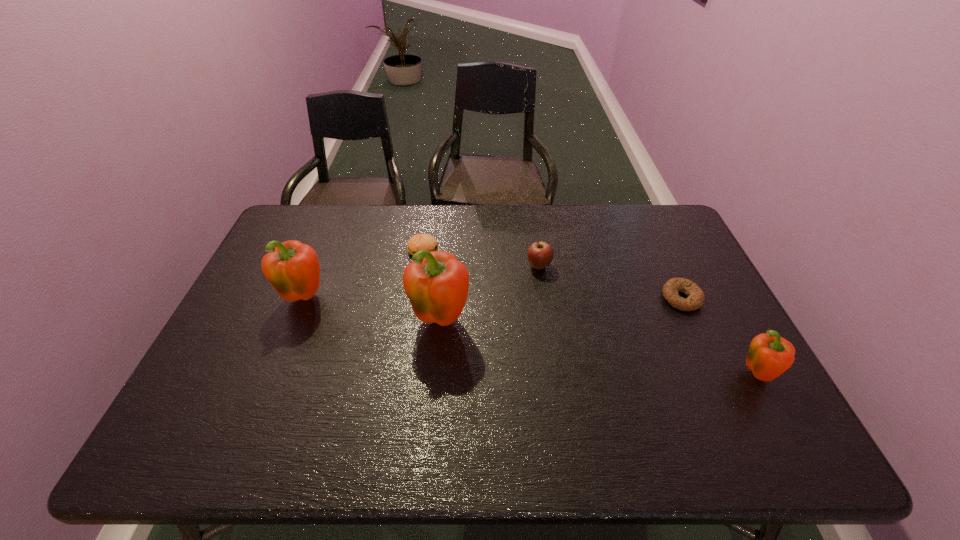
In order to click on object present at the near right corner in this screenshot , I will do `click(768, 357)`.

The width and height of the screenshot is (960, 540). I want to click on vacant space at the far edge, so click(x=450, y=232).

Where is `vacant space at the near edge of the desktop`? The height and width of the screenshot is (540, 960). vacant space at the near edge of the desktop is located at coordinates (274, 407).

The image size is (960, 540). In the image, there is a desktop. Identify the location of vacant space at the left edge. (265, 295).

Find the location of `vacant space at the right edge of the desktop`. vacant space at the right edge of the desktop is located at coordinates click(x=712, y=348).

In the image, there is a desktop. Where is `vacant space at the far left corner`? The image size is (960, 540). vacant space at the far left corner is located at coordinates (289, 220).

The width and height of the screenshot is (960, 540). I want to click on free space at the near right corner of the desktop, so (734, 403).

The image size is (960, 540). I want to click on blank region between the second shortest pepper and the second pepper from right to left, so click(372, 309).

This screenshot has width=960, height=540. Identify the location of vacant area that lies between the bagel and the second shortest object. (552, 274).

Locate an element on the screen. This screenshot has height=540, width=960. vacant area between the apple and the shortest object is located at coordinates (611, 282).